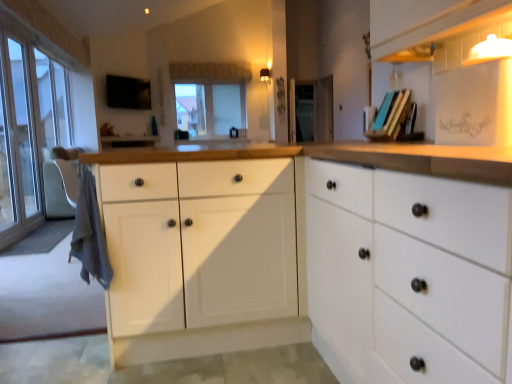
The image size is (512, 384). What do you see at coordinates (390, 116) in the screenshot? I see `matte blue book at upper right` at bounding box center [390, 116].

The height and width of the screenshot is (384, 512). Describe the element at coordinates (304, 110) in the screenshot. I see `transparent glass screen door at center` at that location.

This screenshot has width=512, height=384. Describe the element at coordinates (19, 141) in the screenshot. I see `transparent glass door at left` at that location.

In order to face metallic knob at center, which is the second knob from top to bottom, should I rotate leftwards or rightwards?

Rotate right and turn 3.346 degrees.

Where is `matte white shelf at upper right`? matte white shelf at upper right is located at coordinates (465, 46).

Is metallic black knob at center, which is the third knob from bottom to top, to the right of matte black knob at center, which is the 1th knob from bottom to top, from the viewer's perspective?

In fact, metallic black knob at center, which is the third knob from bottom to top, is to the left of matte black knob at center, which is the 1th knob from bottom to top.

Is metallic black knob at center, which is the first knob in top-to-bottom order, not close to matte black knob at center, which is the 1th knob from bottom to top?

No, metallic black knob at center, which is the first knob in top-to-bottom order, is in close proximity to matte black knob at center, which is the 1th knob from bottom to top.

What's the angular difference between metallic black knob at center, which is the first knob in top-to-bottom order, and matte black knob at center, which is counted as the third knob, starting from the top,'s facing directions?

metallic black knob at center, which is the first knob in top-to-bottom order, and matte black knob at center, which is counted as the third knob, starting from the top, are facing 1.38 degrees away from each other.

The width and height of the screenshot is (512, 384). Find the location of `knob that is the 2nd one above the matte black knob at center, which is counted as the third knob, starting from the top (from a real-world perspective)`. knob that is the 2nd one above the matte black knob at center, which is counted as the third knob, starting from the top (from a real-world perspective) is located at coordinates (280, 82).

Considering the relative positions of matte black knob at center, which is counted as the third knob, starting from the top, and transparent glass door at left in the image provided, is matte black knob at center, which is counted as the third knob, starting from the top, to the left or to the right of transparent glass door at left?

Clearly, matte black knob at center, which is counted as the third knob, starting from the top, is on the right of transparent glass door at left in the image.

Is matte black knob at center, which is the 1th knob from bottom to top, spatially inside transparent glass door at left, or outside of it?

matte black knob at center, which is the 1th knob from bottom to top, is not inside transparent glass door at left, it's outside.

Who is taller, matte black knob at center, which is counted as the third knob, starting from the top, or transparent glass door at left?

With more height is transparent glass door at left.

Find the location of a particular element. The height and width of the screenshot is (384, 512). the 1st knob positioned above the transparent glass door at left (from a real-world perspective) is located at coordinates (281, 108).

Which is behind, point (3, 71) or point (305, 90)?

The point (3, 71) is more distant.

Is transparent glass door at left far away from transparent glass screen door at center?

Yes, transparent glass door at left and transparent glass screen door at center are located far from each other.

Identify the location of glass door below the transparent glass screen door at center (from a real-world perspective). The height and width of the screenshot is (384, 512). 19,141.

Is transparent glass door at left oriented towards transparent glass screen door at center?

No, transparent glass door at left is not aimed at transparent glass screen door at center.

Which of these two, matte black knob at center, which is the 1th knob from bottom to top, or transparent glass window at center, is bigger?

transparent glass window at center.

Can you confirm if matte black knob at center, which is the 1th knob from bottom to top, is shorter than transparent glass window at center?

Yes.

In the image, is matte black knob at center, which is the 1th knob from bottom to top, positioned in front of or behind transparent glass window at center?

Visually, matte black knob at center, which is the 1th knob from bottom to top, is located in front of transparent glass window at center.

From a real-world perspective, is matte black knob at center, which is the 1th knob from bottom to top, below transparent glass window at center?

Indeed, from a real-world perspective, matte black knob at center, which is the 1th knob from bottom to top, is positioned beneath transparent glass window at center.

Is metallic knob at center, which is the second knob from top to bottom, at the right side of matte white shelf at upper right?

No, metallic knob at center, which is the second knob from top to bottom, is not to the right of matte white shelf at upper right.

Measure the distance between metallic knob at center, which is the second knob from top to bottom, and matte white shelf at upper right.

The distance of metallic knob at center, which is the second knob from top to bottom, from matte white shelf at upper right is 4.92 feet.

From a real-world perspective, is metallic knob at center, which is the second knob from top to bottom, physically located above or below matte white shelf at upper right?

metallic knob at center, which is the second knob from top to bottom, is situated higher than matte white shelf at upper right in the real world.

From the image's perspective, is metallic knob at center, which is the second knob from top to bottom, located above or below matte white shelf at upper right?

metallic knob at center, which is the second knob from top to bottom, is situated higher than matte white shelf at upper right in the image.

Can you confirm if transparent glass window at center is thinner than matte white shelf at upper right?

No.

Locate an element on the screen. window screen lying behind the matte white shelf at upper right is located at coordinates (210, 109).

Relative to matte white shelf at upper right, is transparent glass window at center in front or behind?

Clearly, transparent glass window at center is behind matte white shelf at upper right.

Based on their sizes in the image, would you say metallic black knob at center, which is the first knob in top-to-bottom order, is bigger or smaller than transparent glass window at center?

Clearly, metallic black knob at center, which is the first knob in top-to-bottom order, is smaller in size than transparent glass window at center.

Which is behind, metallic black knob at center, which is the third knob from bottom to top, or transparent glass window at center?

transparent glass window at center.

Can you confirm if metallic black knob at center, which is the first knob in top-to-bottom order, is thinner than transparent glass window at center?

Yes, metallic black knob at center, which is the first knob in top-to-bottom order, is thinner than transparent glass window at center.

Which of these two, metallic black knob at center, which is the first knob in top-to-bottom order, or transparent glass window at center, stands taller?

Standing taller between the two is transparent glass window at center.

You are a GUI agent. You are given a task and a screenshot of the screen. Output one action in this format:
    pyautogui.click(x=<x>, y=<y>)
    Task: Click on the 2nd knob above the matte black knob at center, which is the 1th knob from bottom to top (from a real-world perspective)
    The image size is (512, 384).
    Given the screenshot: What is the action you would take?
    pyautogui.click(x=280, y=82)

The height and width of the screenshot is (384, 512). In order to click on the 3rd knob to the right of the transparent glass door at left, counting from the anchor's position in this screenshot , I will do `click(281, 108)`.

Estimate the real-world distances between objects in this image. Which object is closer to matte blue book at upper right, transparent glass door at left or matte black knob at center, which is counted as the third knob, starting from the top?

matte black knob at center, which is counted as the third knob, starting from the top, is closer to matte blue book at upper right.

When comparing their distances from matte black knob at center, which is the 1th knob from bottom to top, does transparent glass door at left or metallic knob at center, which is the second knob from top to bottom, seem further?

transparent glass door at left lies further to matte black knob at center, which is the 1th knob from bottom to top, than the other object.

Considering their positions, is transparent glass door at left positioned closer to metallic knob at center, which is the second knob from top to bottom, than transparent glass window at center?

Among the two, transparent glass door at left is located nearer to metallic knob at center, which is the second knob from top to bottom.

Based on their spatial positions, is transparent glass window at center or transparent glass door at left further from metallic knob at center, the 2th knob ordered from the bottom?

The object further to metallic knob at center, the 2th knob ordered from the bottom, is transparent glass window at center.

Considering their positions, is matte blue book at upper right positioned closer to matte black knob at center, which is counted as the third knob, starting from the top, than transparent glass screen door at center?

transparent glass screen door at center.

Which object lies nearer to the anchor point matte blue book at upper right, metallic knob at center, which is the second knob from top to bottom, or transparent glass screen door at center?

transparent glass screen door at center.

Which object lies nearer to the anchor point matte white shelf at upper right, matte blue book at upper right or transparent glass door at left?

Among the two, matte blue book at upper right is located nearer to matte white shelf at upper right.

Estimate the real-world distances between objects in this image. Which object is closer to matte blue book at upper right, metallic black knob at center, which is the first knob in top-to-bottom order, or transparent glass window at center?

Based on the image, metallic black knob at center, which is the first knob in top-to-bottom order, appears to be nearer to matte blue book at upper right.

Identify the location of glass door between matte blue book at upper right and metallic knob at center, the 2th knob ordered from the bottom, along the z-axis. This screenshot has width=512, height=384. (19, 141).

Locate an element on the screen. book located between matte white shelf at upper right and transparent glass screen door at center in the depth direction is located at coordinates (390, 116).

Identify the location of glass door between matte white shelf at upper right and transparent glass window at center from front to back. (19, 141).

Where is `book between matte white shelf at upper right and metallic black knob at center, which is the first knob in top-to-bottom order, along the z-axis`? book between matte white shelf at upper right and metallic black knob at center, which is the first knob in top-to-bottom order, along the z-axis is located at coordinates (390, 116).